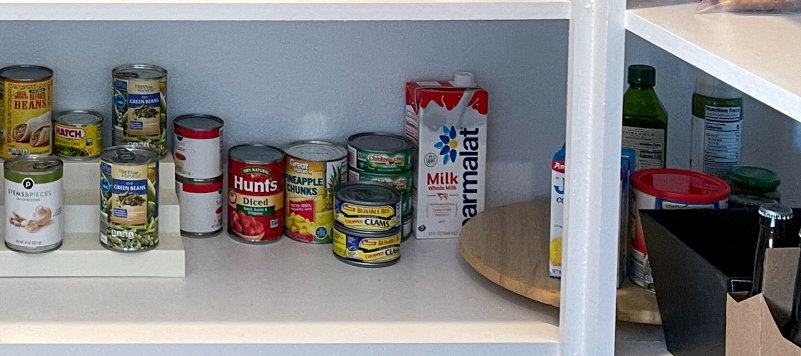
Where is `black fabric basket`? The height and width of the screenshot is (356, 801). black fabric basket is located at coordinates coord(677,266).